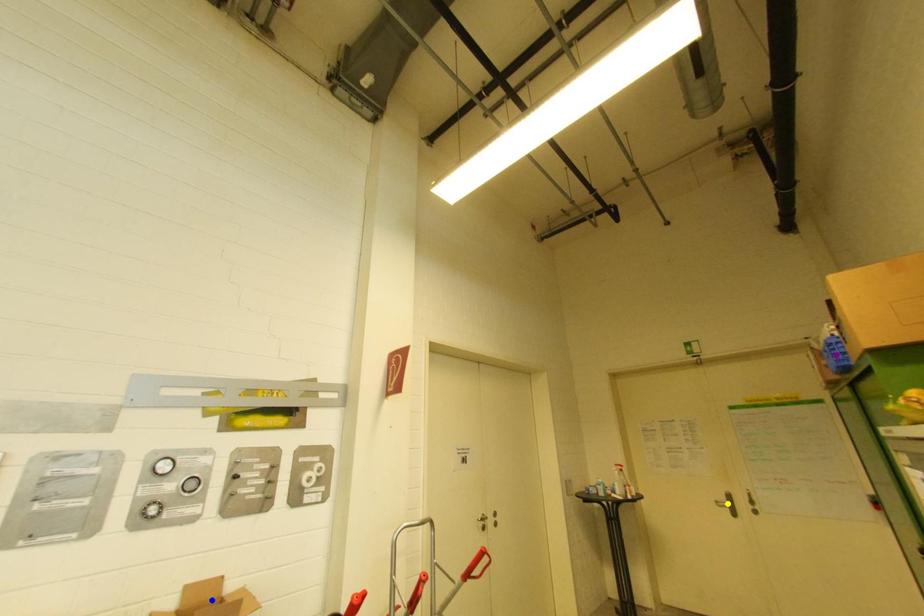
Order these from farthest to nearest:
blue point | purple point | yellow point

1. yellow point
2. purple point
3. blue point